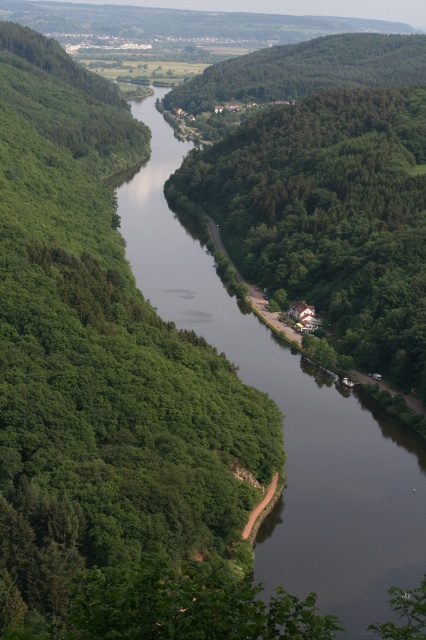
Question: Which of the following is the farthest from the observer?

Choices:
 (A) green leafy tree at center
 (B) dark reflective water at center

Answer: (A)

Question: Which point is farther from the camera taking this photo?

Choices:
 (A) (302, 460)
 (B) (210, 188)

Answer: (B)

Question: Does green leafy tree at center appear on the right side of dark reflective water at center?

Choices:
 (A) yes
 (B) no

Answer: (A)

Question: Which of the following is the farthest from the observer?

Choices:
 (A) green leafy tree at center
 (B) dark reflective water at center

Answer: (A)

Question: Does green leafy tree at center have a lesser width compared to dark reflective water at center?

Choices:
 (A) no
 (B) yes

Answer: (A)

Question: Can you confirm if green leafy tree at center is smaller than dark reflective water at center?

Choices:
 (A) yes
 (B) no

Answer: (A)